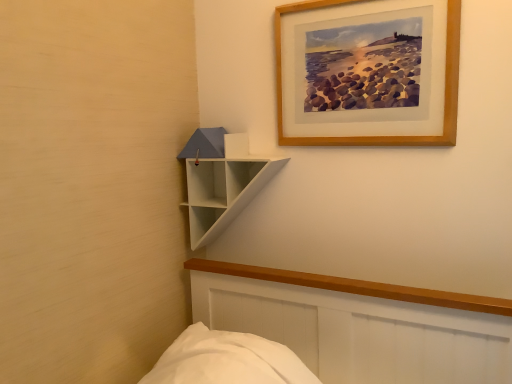
What is the approximate width of wooden picture frame at upper right?

wooden picture frame at upper right is 1.66 inches in width.

Describe the element at coordinates (378, 136) in the screenshot. I see `wooden picture frame at upper right` at that location.

Measure the distance between point [454,140] and camera.

They are 3.72 feet apart.

This screenshot has height=384, width=512. I want to click on wooden picture frame at upper right, so [378, 136].

What is the approximate height of wooden picture frame at upper right?

It is 17.32 inches.

Measure the distance between wooden picture frame at upper right and camera.

wooden picture frame at upper right is 3.51 feet from camera.

The image size is (512, 384). What do you see at coordinates (221, 181) in the screenshot?
I see `white matte shelf at upper left` at bounding box center [221, 181].

Find the location of a particular element. This screenshot has width=512, height=384. white matte shelf at upper left is located at coordinates (221, 181).

This screenshot has height=384, width=512. What are the coordinates of `wooden picture frame at upper right` in the screenshot? It's located at (378, 136).

Considering the positions of objects wooden picture frame at upper right and white matte shelf at upper left in the image provided, who is more to the left, wooden picture frame at upper right or white matte shelf at upper left?

Positioned to the left is white matte shelf at upper left.

Does wooden picture frame at upper right lie in front of white matte shelf at upper left?

Yes, it is in front of white matte shelf at upper left.

From the picture: Which is further, [278,7] or [261,167]?

The point [261,167] is behind.

From the image's perspective, between wooden picture frame at upper right and white matte shelf at upper left, which one is located above?

wooden picture frame at upper right.

From a real-world perspective, is wooden picture frame at upper right positioned under white matte shelf at upper left based on gravity?

Incorrect, from a real-world perspective, wooden picture frame at upper right is higher than white matte shelf at upper left.

In the scene shown: Considering the sizes of wooden picture frame at upper right and white matte shelf at upper left in the image, is wooden picture frame at upper right wider or thinner than white matte shelf at upper left?

Considering their sizes, wooden picture frame at upper right looks slimmer than white matte shelf at upper left.

Considering the sizes of objects wooden picture frame at upper right and white matte shelf at upper left in the image provided, who is taller, wooden picture frame at upper right or white matte shelf at upper left?

With more height is wooden picture frame at upper right.

Does wooden picture frame at upper right have a smaller size compared to white matte shelf at upper left?

Yes, wooden picture frame at upper right is smaller than white matte shelf at upper left.

From the picture: Can white matte shelf at upper left be found inside wooden picture frame at upper right?

That's incorrect, white matte shelf at upper left is not inside wooden picture frame at upper right.

Is there a large distance between wooden picture frame at upper right and white matte shelf at upper left?

No, wooden picture frame at upper right is not far away from white matte shelf at upper left.

Could you tell me if wooden picture frame at upper right is turned towards white matte shelf at upper left?

No, wooden picture frame at upper right is not facing towards white matte shelf at upper left.

Based on the photo, what's the angular difference between wooden picture frame at upper right and white matte shelf at upper left's facing directions?

The facing directions of wooden picture frame at upper right and white matte shelf at upper left are 2.6 degrees apart.

Locate an element on the screen. picture frame above the white matte shelf at upper left (from a real-world perspective) is located at coordinates (378, 136).

Can you confirm if white matte shelf at upper left is positioned to the left of wooden picture frame at upper right?

Yes.

Which is behind, white matte shelf at upper left or wooden picture frame at upper right?

white matte shelf at upper left is further from the camera.

Is point (273, 166) closer to camera compared to point (402, 144)?

No, it is not.

From the image's perspective, is white matte shelf at upper left on top of wooden picture frame at upper right?

No.

From a real-world perspective, which is physically below, white matte shelf at upper left or wooden picture frame at upper right?

From a 3D spatial view, white matte shelf at upper left is below.

Considering the sizes of objects white matte shelf at upper left and wooden picture frame at upper right in the image provided, who is wider, white matte shelf at upper left or wooden picture frame at upper right?

Wider between the two is white matte shelf at upper left.

In the scene shown: Who is shorter, white matte shelf at upper left or wooden picture frame at upper right?

Standing shorter between the two is white matte shelf at upper left.

Can you confirm if white matte shelf at upper left is smaller than wooden picture frame at upper right?

Incorrect, white matte shelf at upper left is not smaller in size than wooden picture frame at upper right.

Is wooden picture frame at upper right a part of white matte shelf at upper left?

That's incorrect, wooden picture frame at upper right is not inside white matte shelf at upper left.

Is white matte shelf at upper left placed right next to wooden picture frame at upper right?

No, white matte shelf at upper left is not next to wooden picture frame at upper right.

Is white matte shelf at upper left positioned with its back to wooden picture frame at upper right?

white matte shelf at upper left does not have its back to wooden picture frame at upper right.

How different are the orientations of white matte shelf at upper left and wooden picture frame at upper right in degrees?

2.6 degrees separate the facing orientations of white matte shelf at upper left and wooden picture frame at upper right.

Image resolution: width=512 pixels, height=384 pixels. Identify the location of shelf below the wooden picture frame at upper right (from a real-world perspective). (221, 181).

You are a GUI agent. You are given a task and a screenshot of the screen. Output one action in this format:
    pyautogui.click(x=<x>, y=<y>)
    Task: Click on the picture frame located above the white matte shelf at upper left (from the image's perspective)
    Image resolution: width=512 pixels, height=384 pixels.
    Given the screenshot: What is the action you would take?
    pyautogui.click(x=378, y=136)

Locate an element on the screen. The image size is (512, 384). shelf below the wooden picture frame at upper right (from the image's perspective) is located at coordinates (221, 181).